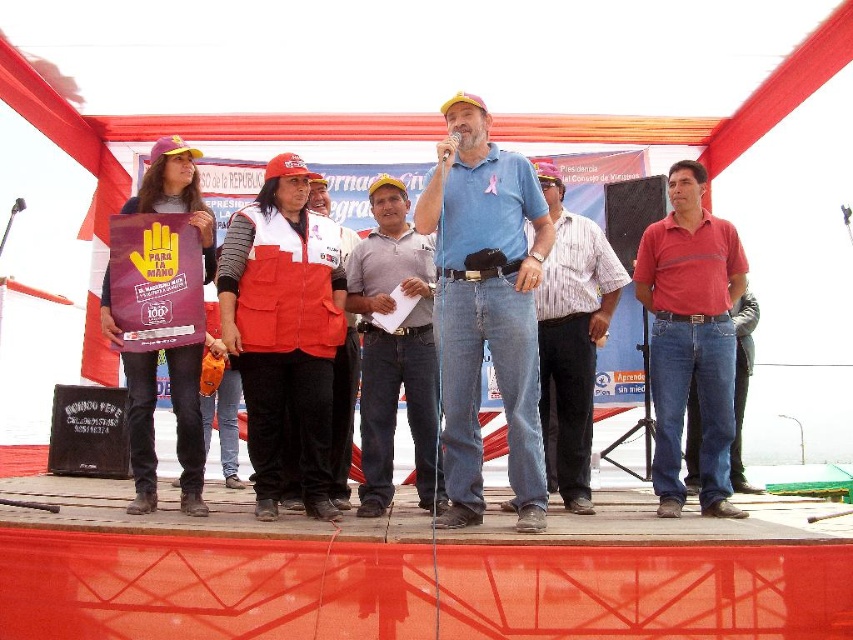
Question: Does red fabric vest at center have a smaller size compared to denim jacket at left?

Choices:
 (A) no
 (B) yes

Answer: (B)

Question: Considering the relative positions of gray cotton shirt at center and denim jacket at left in the image provided, where is gray cotton shirt at center located with respect to denim jacket at left?

Choices:
 (A) above
 (B) below

Answer: (B)

Question: Which object is farther from the camera taking this photo?

Choices:
 (A) gray cotton shirt at center
 (B) matte blue shirt at center
 (C) red fabric vest at center

Answer: (C)

Question: Does matte blue shirt at center have a lesser width compared to denim jacket at left?

Choices:
 (A) no
 (B) yes

Answer: (A)

Question: Which point is closer to the camera taking this photo?

Choices:
 (A) (343, 436)
 (B) (714, 440)
 (C) (293, 429)

Answer: (B)

Question: Based on their relative distances, which object is nearer to the gray cotton shirt at center?

Choices:
 (A) red fabric vest at center
 (B) striped cotton shirt at center
 (C) velvet red vest at center
 (D) matte blue shirt at center

Answer: (C)